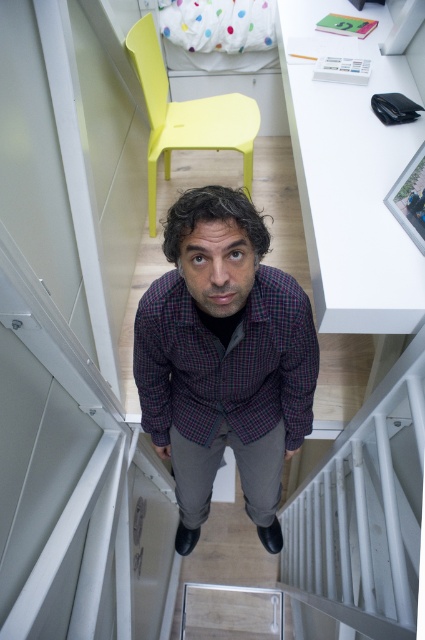
You are navigating a drone through a narrow staircase into a room. You need to fly from the bottom of the stairs to a point closer to the camera. Which of the two points, point (144, 300) or point (249, 161), should you aim for?

You should aim for point (144, 300) because it is closer to the camera than point (249, 161).

You are a delivery person trying to determine if the plaid fabric shirt at center can be placed on the yellow plastic chair at upper center without falling off. Based on their sizes, is this possible?

The plaid fabric shirt at center is larger than the yellow plastic chair at upper center, so placing it might cause it to fall off due to the size mismatch.

You are a delivery person carrying a package that requires a space of 4 feet to place it down. You see the plaid fabric shirt at center and the yellow plastic chair at upper center in the room. Is there enough space between them to place your package?

The distance between the plaid fabric shirt at center and the yellow plastic chair at upper center is 3.89 feet, which is slightly less than the required 4 feet. Therefore, there isn not enough space to place the package between them.